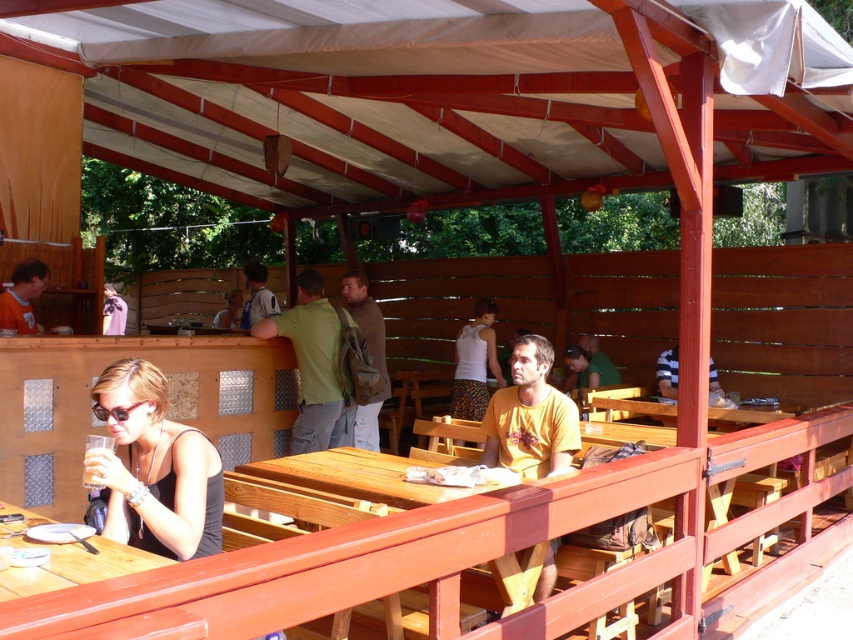
You are standing at the entrance of the outdoor seating area and want to walk towards the point marked as point (260, 284). However, there is an obstacle at point (223, 323). Will you encounter the obstacle before reaching your destination?

Point (260, 284) is in front of point (223, 323), so you will reach the destination before encountering the obstacle at point (223, 323).